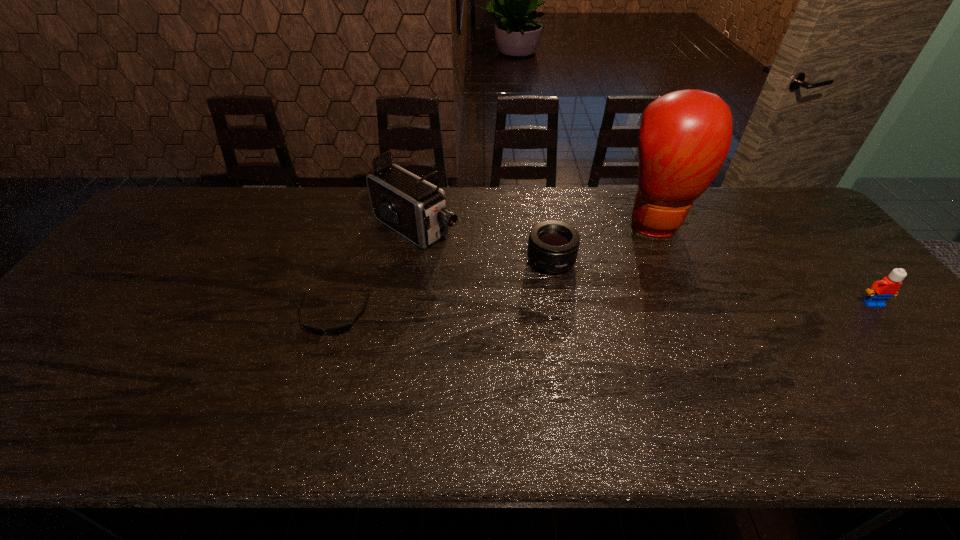
Locate an element on the screen. boxing glove that is at the far edge is located at coordinates (684, 138).

Locate an element on the screen. Image resolution: width=960 pixels, height=540 pixels. object present at the right edge is located at coordinates (880, 291).

The image size is (960, 540). In the image, there is a desktop. What are the coordinates of `free space at the far edge` in the screenshot? It's located at (371, 206).

Where is `free region at the near edge of the desktop`? Image resolution: width=960 pixels, height=540 pixels. free region at the near edge of the desktop is located at coordinates (670, 392).

The height and width of the screenshot is (540, 960). I want to click on vacant space at the left edge of the desktop, so click(93, 314).

Locate an element on the screen. vacant space at the right edge of the desktop is located at coordinates (825, 239).

Find the location of `free space at the near right corner of the desktop`. free space at the near right corner of the desktop is located at coordinates (935, 366).

You are a GUI agent. You are given a task and a screenshot of the screen. Output one action in this format:
    pyautogui.click(x=<x>, y=<y>)
    Task: Click on the unoccupied area between the fourth tallest object and the Lego
    The width and height of the screenshot is (960, 540).
    Given the screenshot: What is the action you would take?
    pyautogui.click(x=712, y=282)

Image resolution: width=960 pixels, height=540 pixels. I want to click on free space between the Lego and the shortest object, so click(x=603, y=310).

You are a GUI agent. You are given a task and a screenshot of the screen. Output one action in this format:
    pyautogui.click(x=<x>, y=<y>)
    Task: Click on the free point between the sunglasses and the camcorder
    The width and height of the screenshot is (960, 540).
    Given the screenshot: What is the action you would take?
    pyautogui.click(x=374, y=272)